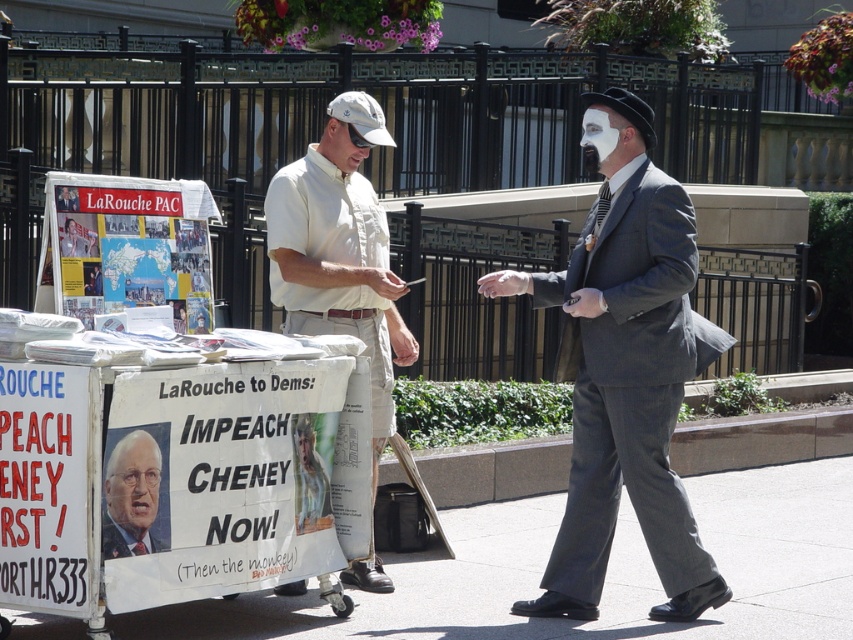
Question: In this image, where is gray suit at center located relative to smooth plastic poster at center?

Choices:
 (A) below
 (B) above

Answer: (B)

Question: Which object is the closest to the gray suit at center?

Choices:
 (A) light beige cotton shirt at center
 (B) smooth plastic poster at center

Answer: (A)

Question: Is gray asphalt pavement at lower center to the left of smooth plastic poster at center from the viewer's perspective?

Choices:
 (A) yes
 (B) no

Answer: (B)

Question: Which point is closer to the camera?

Choices:
 (A) gray asphalt pavement at lower center
 (B) gray suit at center

Answer: (A)

Question: Does gray asphalt pavement at lower center appear on the right side of gray suit at center?

Choices:
 (A) no
 (B) yes

Answer: (A)

Question: Which point appears farthest from the camera in this image?

Choices:
 (A) (624, 264)
 (B) (849, 525)
 (C) (125, 488)
 (D) (338, 221)

Answer: (B)